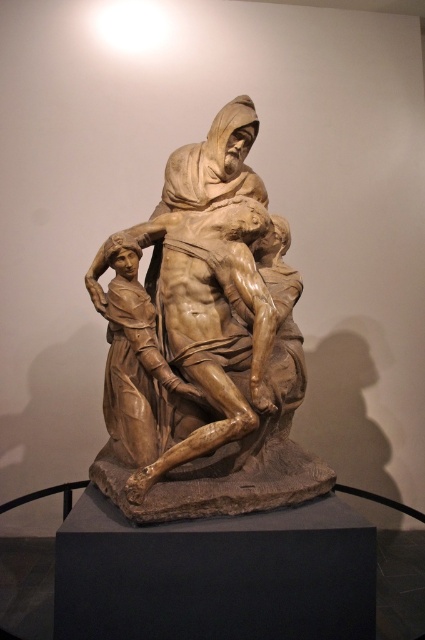
Question: Is brown wood sculpture at center thinner than wooden sculpture of man at center?

Choices:
 (A) no
 (B) yes

Answer: (A)

Question: Observing the image, what is the correct spatial positioning of brown wood sculpture at center in reference to wooden sculpture of man at center?

Choices:
 (A) above
 (B) below

Answer: (A)

Question: Which of the following is the closest to the observer?

Choices:
 (A) pyautogui.click(x=136, y=481)
 (B) pyautogui.click(x=127, y=310)
 (C) pyautogui.click(x=136, y=371)

Answer: (A)

Question: Considering the relative positions of brown wood sculpture at center and brown wood statue at center in the image provided, where is brown wood sculpture at center located with respect to brown wood statue at center?

Choices:
 (A) above
 (B) below

Answer: (A)

Question: Considering the real-world distances, which object is closest to the wooden sculpture of man at center?

Choices:
 (A) brown wood sculpture at center
 (B) brown wood statue at center

Answer: (A)

Question: Which point is farther to the camera?

Choices:
 (A) (240, 214)
 (B) (180, 408)
 (C) (142, 346)

Answer: (A)